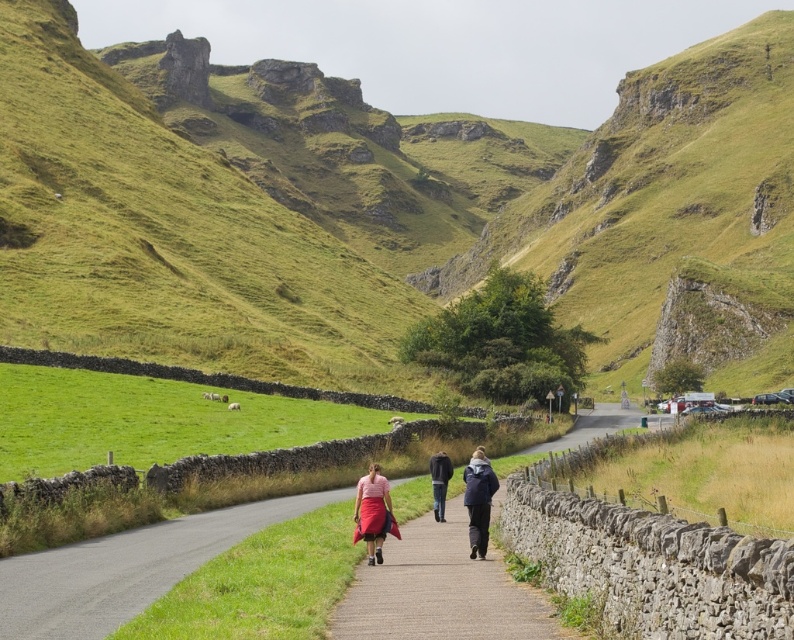
Question: Is paved stone path at center to the right of pink fabric skirt at center from the viewer's perspective?

Choices:
 (A) yes
 (B) no

Answer: (A)

Question: Which object is the closest to the matte pink skirt at center?

Choices:
 (A) dark gray jacket at center
 (B) paved stone path at center

Answer: (A)

Question: Among these points, which one is nearest to the camera?

Choices:
 (A) (437, 456)
 (B) (553, 243)
 (C) (372, 477)

Answer: (C)

Question: Which point is closer to the camera?

Choices:
 (A) (388, 488)
 (B) (418, 586)

Answer: (B)

Question: Does matte pink skirt at center have a larger size compared to pink fabric skirt at center?

Choices:
 (A) no
 (B) yes

Answer: (B)

Question: Observing the image, what is the correct spatial positioning of paved stone path at center in reference to pink fabric skirt at center?

Choices:
 (A) above
 (B) below

Answer: (B)